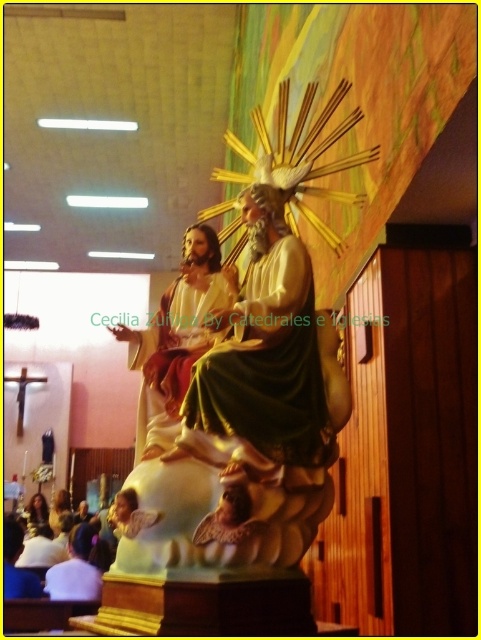
Which is behind, point (294, 243) or point (75, 525)?

The point (75, 525) is more distant.

Can you confirm if gold textured statue at center is taller than white fabric shirt at lower left?

In fact, gold textured statue at center may be shorter than white fabric shirt at lower left.

Who is more forward, (256, 429) or (70, 573)?

Positioned in front is point (256, 429).

Locate an element on the screen. This screenshot has width=481, height=640. gold textured statue at center is located at coordinates (263, 365).

Does point (326, 419) come behind point (206, 291)?

No.

Is point (290, 314) in front of point (192, 275)?

That is True.

Describe the element at coordinates (263, 365) in the screenshot. The height and width of the screenshot is (640, 481). I see `gold textured statue at center` at that location.

Locate an element on the screen. gold textured statue at center is located at coordinates (263, 365).

Who is shorter, matte gold statue at center or white fabric shirt at lower left?

With less height is white fabric shirt at lower left.

From the picture: Does matte gold statue at center have a greater height compared to white fabric shirt at lower left?

Yes, matte gold statue at center is taller than white fabric shirt at lower left.

Where is `matte gold statue at center`? The image size is (481, 640). matte gold statue at center is located at coordinates (175, 339).

Locate an element on the screen. matte gold statue at center is located at coordinates (175, 339).